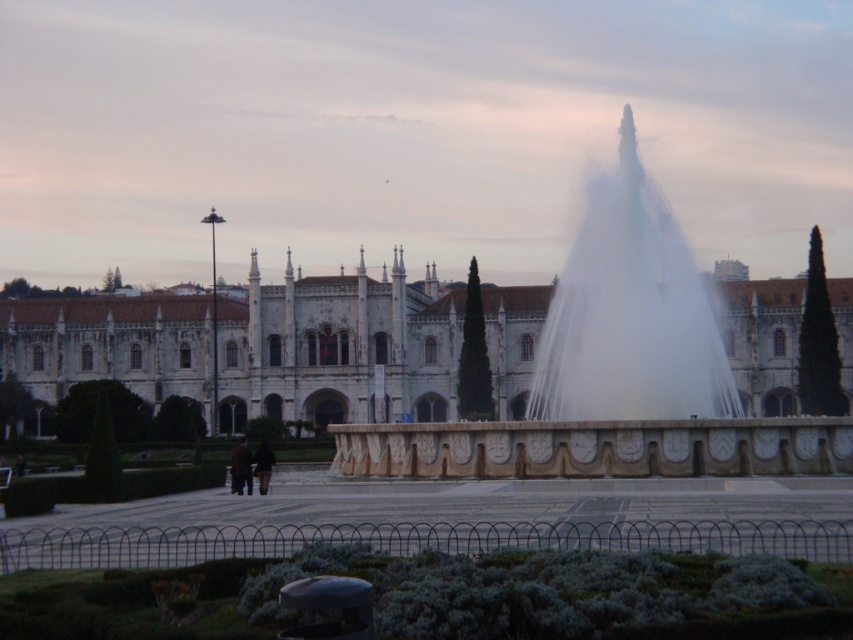
You are a visitor trying to take a photo of the white stone building at center and the white stone fountain at center. If you want to capture both in a single frame without moving your camera, which one should you zoom out more to include?

You should zoom out more to include the white stone building at center because it might be wider than the white stone fountain at center.

You are a tour guide leading a group to the white stone building at center. You notice the white stone fountain at center is in the way. Can you walk directly to the building without going around the fountain?

The distance between the white stone building at center and the white stone fountain at center is 15.56 meters, so you can walk directly to the building without needing to go around the fountain since the fountain is not blocking the path.

Based on the photo, you are standing at the camera position looking at the white stone building at center. If you walk straight towards it for 400 feet, will you still be able to see the entire building in your view?

The distance between you and the white stone building at center is 458.49 feet. After walking 400 feet closer, you would be 58.49 feet away from it. Since you are now much closer, you might not see the entire building in your view because the building is large and your field of view narrows as you get closer.